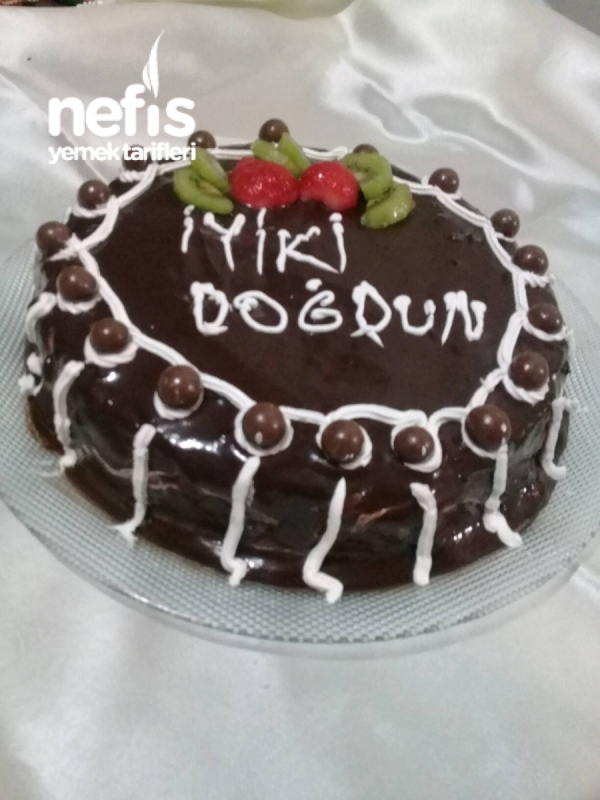
This screenshot has width=600, height=800. I want to click on white surface, so click(x=83, y=680), click(x=563, y=722), click(x=446, y=60), click(x=86, y=66).